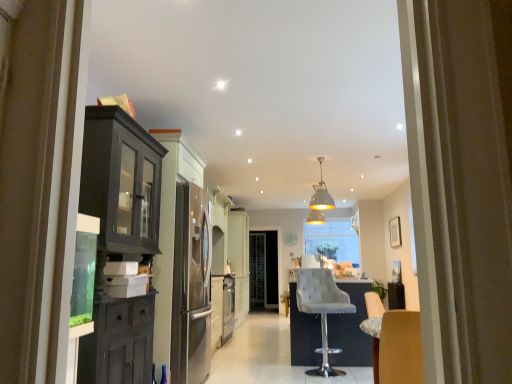
The width and height of the screenshot is (512, 384). Describe the element at coordinates (322, 309) in the screenshot. I see `gray fabric bar stool at center` at that location.

At what (x,y) coordinates should I click in order to perform the action: click on gray fabric bar stool at center. Please return your answer as a coordinate pair (x, y). The image size is (512, 384). Looking at the image, I should click on (322, 309).

Describe the element at coordinates (320, 201) in the screenshot. The width and height of the screenshot is (512, 384). I see `white matte pendant light at center` at that location.

Where is `white matte pendant light at center`? white matte pendant light at center is located at coordinates tap(320, 201).

The height and width of the screenshot is (384, 512). In order to click on gray fabric bar stool at center in this screenshot , I will do `click(322, 309)`.

Does white matte pendant light at center appear on the right side of gray fabric bar stool at center?

Yes, white matte pendant light at center is to the right of gray fabric bar stool at center.

Which object is more forward, white matte pendant light at center or gray fabric bar stool at center?

gray fabric bar stool at center is more forward.

Does point (317, 197) lie behind point (324, 359)?

That is True.

From the image's perspective, which object appears higher, white matte pendant light at center or gray fabric bar stool at center?

From the image's view, white matte pendant light at center is above.

From a real-world perspective, is white matte pendant light at center under gray fabric bar stool at center?

No, from a real-world perspective, white matte pendant light at center is not under gray fabric bar stool at center.

In terms of width, does white matte pendant light at center look wider or thinner when compared to gray fabric bar stool at center?

In the image, white matte pendant light at center appears to be more narrow than gray fabric bar stool at center.

Does white matte pendant light at center have a greater height compared to gray fabric bar stool at center?

No, white matte pendant light at center is not taller than gray fabric bar stool at center.

Is white matte pendant light at center smaller than gray fabric bar stool at center?

Correct, white matte pendant light at center occupies less space than gray fabric bar stool at center.

Is white matte pendant light at center inside the boundaries of gray fabric bar stool at center, or outside?

white matte pendant light at center is located beyond the bounds of gray fabric bar stool at center.

Is white matte pendant light at center positioned far away from gray fabric bar stool at center?

Absolutely, white matte pendant light at center is distant from gray fabric bar stool at center.

Is white matte pendant light at center oriented towards gray fabric bar stool at center?

No, white matte pendant light at center is not facing towards gray fabric bar stool at center.

Can you tell me how much white matte pendant light at center and gray fabric bar stool at center differ in facing direction?

13 degrees.

What are the coordinates of `light fixture located above the gray fabric bar stool at center (from a real-world perspective)` in the screenshot? It's located at (320, 201).

Which object is positioned more to the right, gray fabric bar stool at center or white matte pendant light at center?

white matte pendant light at center is more to the right.

Is gray fabric bar stool at center positioned before white matte pendant light at center?

Yes, gray fabric bar stool at center is closer to the camera.

Considering the positions of points (332, 311) and (322, 199), is point (332, 311) farther from camera compared to point (322, 199)?

No, (332, 311) is in front of (322, 199).

From the image's perspective, is gray fabric bar stool at center under white matte pendant light at center?

Yes, from the image's perspective, gray fabric bar stool at center is beneath white matte pendant light at center.

From a real-world perspective, is gray fabric bar stool at center below white matte pendant light at center?

Yes, from a real-world perspective, gray fabric bar stool at center is below white matte pendant light at center.

Which object is thinner, gray fabric bar stool at center or white matte pendant light at center?

white matte pendant light at center is thinner.

Between gray fabric bar stool at center and white matte pendant light at center, which one has more height?

gray fabric bar stool at center.

Is gray fabric bar stool at center smaller than white matte pendant light at center?

Incorrect, gray fabric bar stool at center is not smaller in size than white matte pendant light at center.

Do you think gray fabric bar stool at center is within white matte pendant light at center, or outside of it?

gray fabric bar stool at center exists outside the volume of white matte pendant light at center.

Are gray fabric bar stool at center and white matte pendant light at center located far from each other?

gray fabric bar stool at center is positioned a significant distance from white matte pendant light at center.

Is gray fabric bar stool at center oriented towards white matte pendant light at center?

No, gray fabric bar stool at center is not aimed at white matte pendant light at center.

How far apart are gray fabric bar stool at center and white matte pendant light at center?

The distance of gray fabric bar stool at center from white matte pendant light at center is 8.63 feet.

Where is `chair below the white matte pendant light at center (from the image's perspective)`? The width and height of the screenshot is (512, 384). chair below the white matte pendant light at center (from the image's perspective) is located at coordinates (322, 309).

Where is `light fixture located above the gray fabric bar stool at center (from the image's perspective)`? light fixture located above the gray fabric bar stool at center (from the image's perspective) is located at coordinates (320, 201).

This screenshot has height=384, width=512. In order to click on light fixture on the right of gray fabric bar stool at center in this screenshot , I will do `click(320, 201)`.